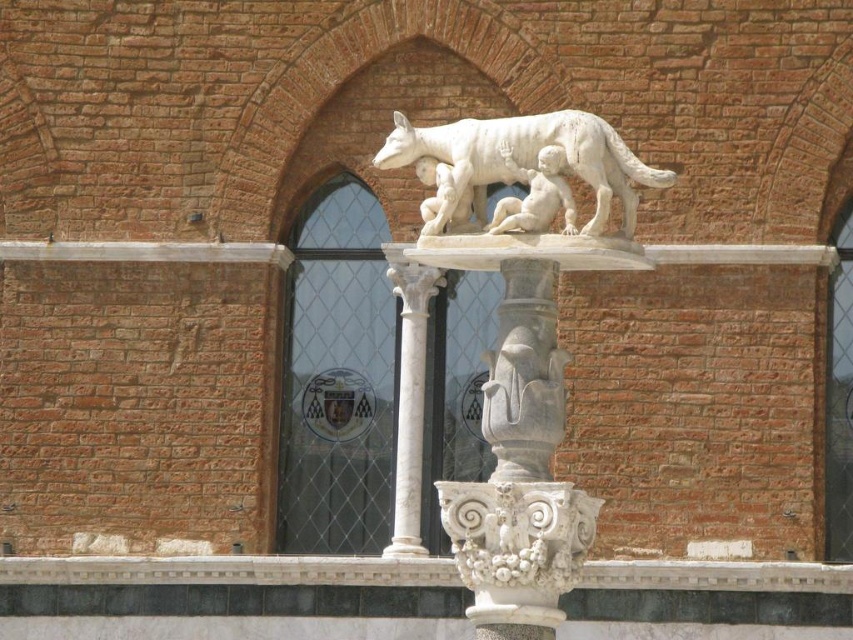
Based on the photo, you are an architect analyzing the historical building. You need to locate the white marble column at center. Where is it positioned in the image?

The white marble column at center is located at point (409, 396) in the image.

You are standing in front of the statue of Romulus and Remus. There are two points marked on the pedestal. One is at point coordinates [403,381] and the other at [532,221]. If you want to touch the point that is closer to you, which coordinates should you aim for?

You should aim for point coordinates [403,381] because it is further to the camera than point coordinates [532,221], making it closer to you.

You are an art student analyzing the statue of Romulus and Remus. You observe the white marble wolf at center and the white marble baby at upper center. Which of these two figures is significantly larger in height?

The white marble wolf at center is much taller than the white marble baby at upper center.